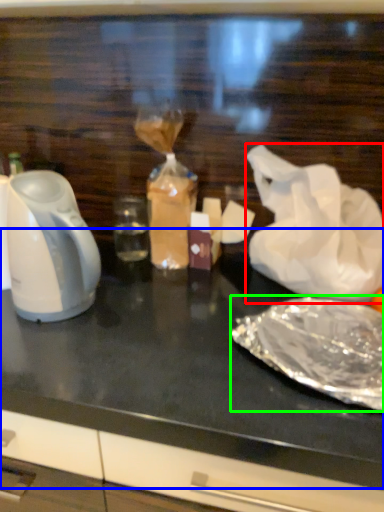
Question: Which object is the closest to the plastic bag (highlighted by a red box)? Choose among these: table top (highlighted by a blue box) or food (highlighted by a green box).

Choices:
 (A) table top
 (B) food

Answer: (B)